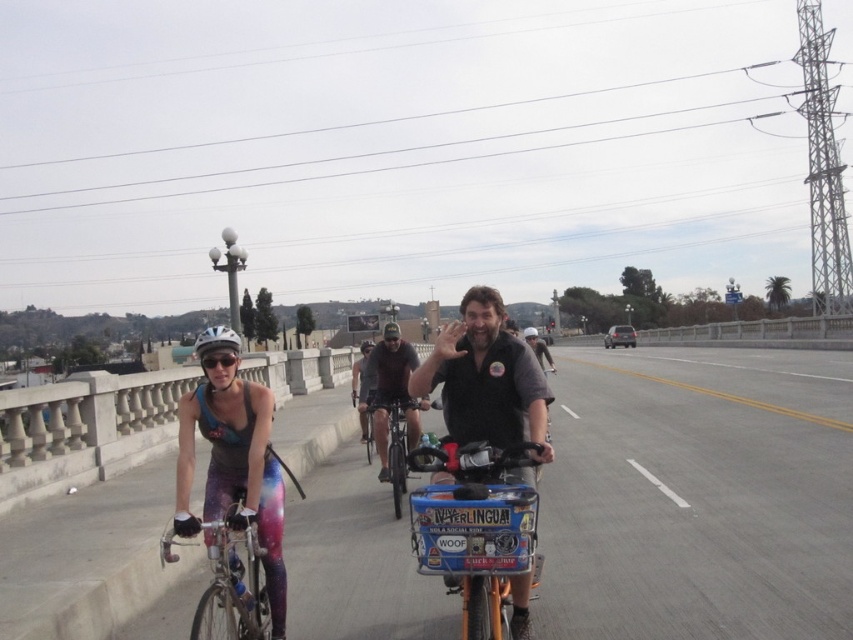
Question: Which point is farther to the camera?

Choices:
 (A) pyautogui.click(x=212, y=488)
 (B) pyautogui.click(x=381, y=360)

Answer: (B)

Question: Is orange metallic bicycle at center wider than dark brown leather jacket at center?

Choices:
 (A) yes
 (B) no

Answer: (B)

Question: Does gray asphalt highway at center have a larger size compared to shiny metallic bicycle at center?

Choices:
 (A) yes
 (B) no

Answer: (A)

Question: Which point is closer to the camera?

Choices:
 (A) (363, 420)
 (B) (196, 349)

Answer: (B)

Question: Can you confirm if neon galaxy leggings at left is positioned to the right of metallic silver bicycle at center?

Choices:
 (A) yes
 (B) no

Answer: (B)

Question: Estimate the real-world distances between objects in this image. Which object is farther from the dark brown leather jacket at center?

Choices:
 (A) metallic silver bicycle at center
 (B) neon galaxy leggings at left

Answer: (A)